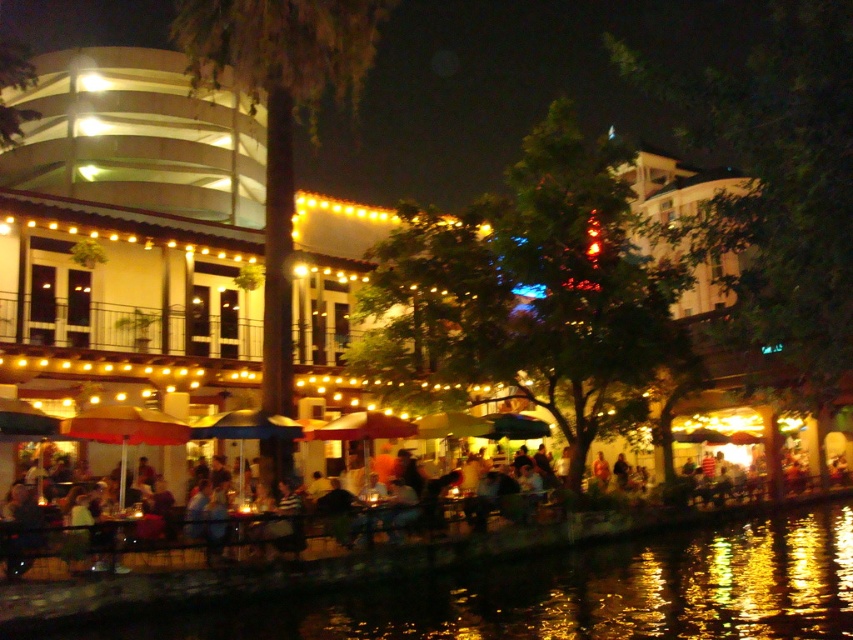
You are standing at the railing along the riverside and notice a point marked at coordinates (305,573). What is located at that point?

The point at coordinates (305,573) indicates black reflective water at lower center.

You are a customer sitting at a table near the river and want to place your phone on the nearest flat surface. Which object between the black reflective water at lower center and the matte black umbrella at lower center can you place your phone on?

The black reflective water at lower center is positioned on the right side of matte black umbrella at lower center. However, you cannot place your phone on the black reflective water at lower center because it is a body of water. The matte black umbrella at lower center, being a solid object, is the appropriate surface for placing your phone.

You are a waiter at the riverside restaurant and need to place a new table at the point closest to the railing. The coordinates given are point (343, 563) and point (61, 570). Which coordinate should you choose?

Point (61, 570) is closer to the railing because it is in front of point (343, 563), making it the better choice for placing the table near the railing.